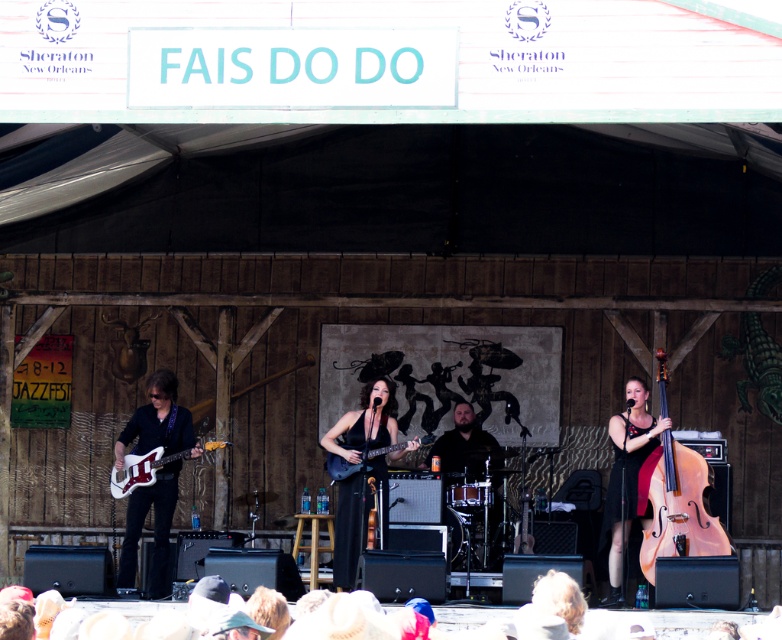
Looking at this image, you are a photographer at the jazz festival and want to capture a shot of the light pink polished wood cello at right and the black matte guitar at center. From your current position, which instrument is closer to the front of the stage?

The light pink polished wood cello at right is positioned under the black matte guitar at center, so the black matte guitar at center is closer to the front of the stage.

You are a stagehand who needs to move the light pink polished wood cello at right and the matte black electric guitar at center to the storage room. Which instrument will require more vertical space when storing them upright?

The light pink polished wood cello at right is much taller as matte black electric guitar at center, so it will require more vertical space when storing them upright.

Looking at this image, based on the scene description, where is the light pink polished wood cello at right located in the image?

The light pink polished wood cello at right is located at point (x=680, y=509) in the image.